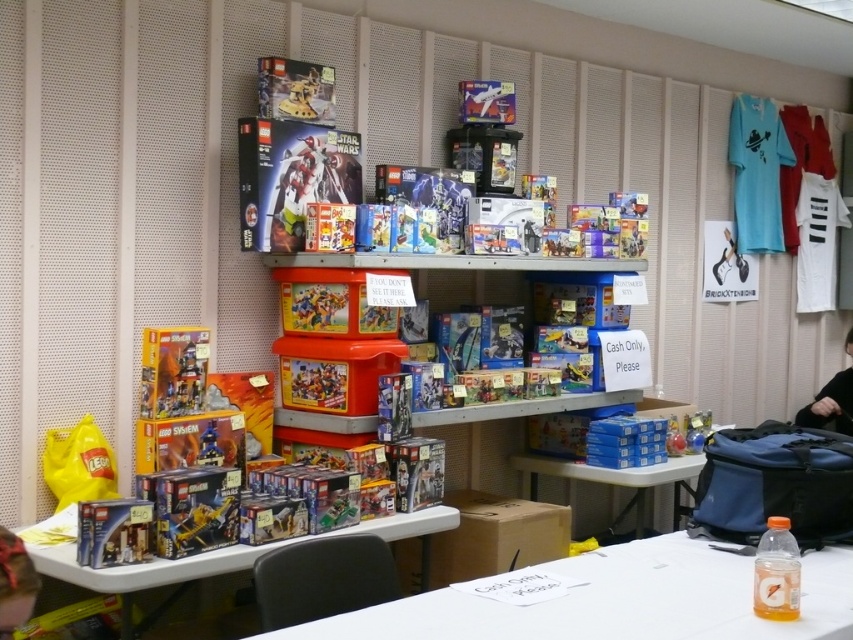
You are standing at the point marked as point (303,205) in the LEGO store. You want to retrieve a LEGO box from a shelf that is 2.5 meters away from you. Can you reach it without moving closer?

The distance between you and the camera is 3.11 meters. The shelf is 2.5 meters away from you, which is within the 3.11 meters range. Therefore, you can reach the LEGO box without moving closer.

You are a cashier in the LEGO store. You need to place the black fabric person at lower right and the translucent plastic minifigure at center into a storage box. The box can only hold items that are smaller than 15 inches in height. Can both items fit?

The black fabric person at lower right is larger in size than the translucent plastic minifigure at center. Since the box can only hold items smaller than 15 inches, and the black fabric person is larger, it might exceed the size limit. However, without exact measurements, we can only assume the minifigure fits, but the fabric person may not. But according to the description, the fabric person is larger than the minifigure. If the minifigure is under 15 inches, the fabric person might still be under. Wait,

You are a customer in the LEGO store and want to buy the translucent plastic minifigure at center. However, you notice the black fabric person at lower right is blocking your path to the minifigure. Can you walk around them to reach the minifigure?

The black fabric person at lower right is located below the translucent plastic minifigure at center, so you can walk around them to reach the minifigure since they are positioned lower and not directly in front of it.